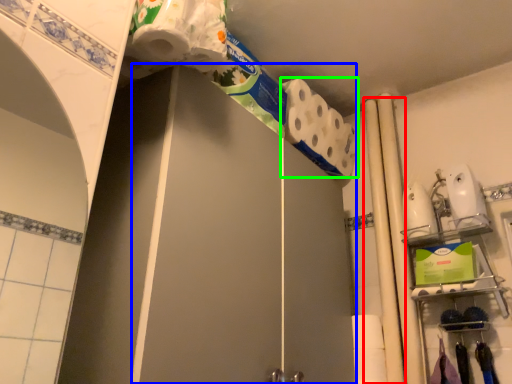
Question: Which is nearer to the beam (highlighted by a red box)? screen door (highlighted by a blue box) or toilet paper (highlighted by a green box).

Choices:
 (A) screen door
 (B) toilet paper

Answer: (B)